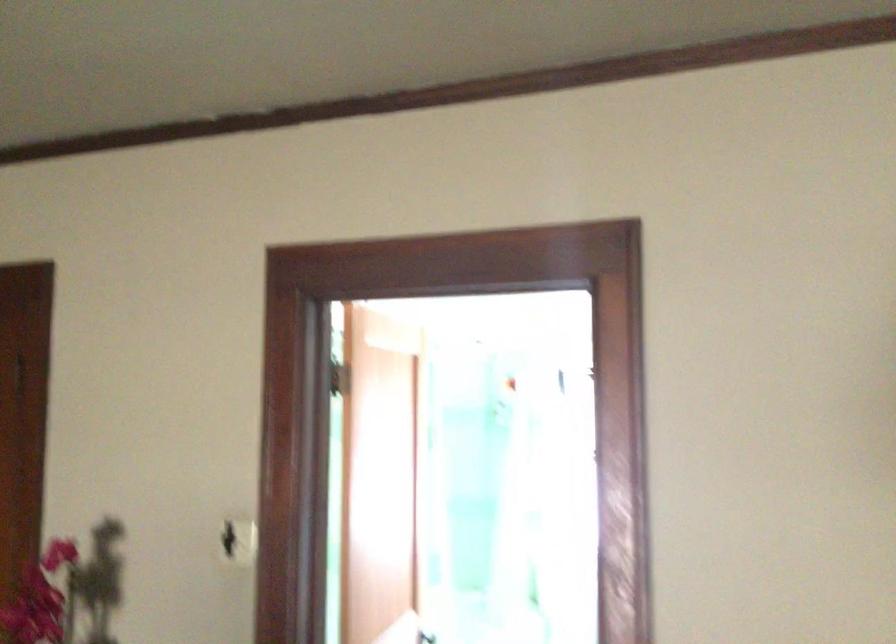
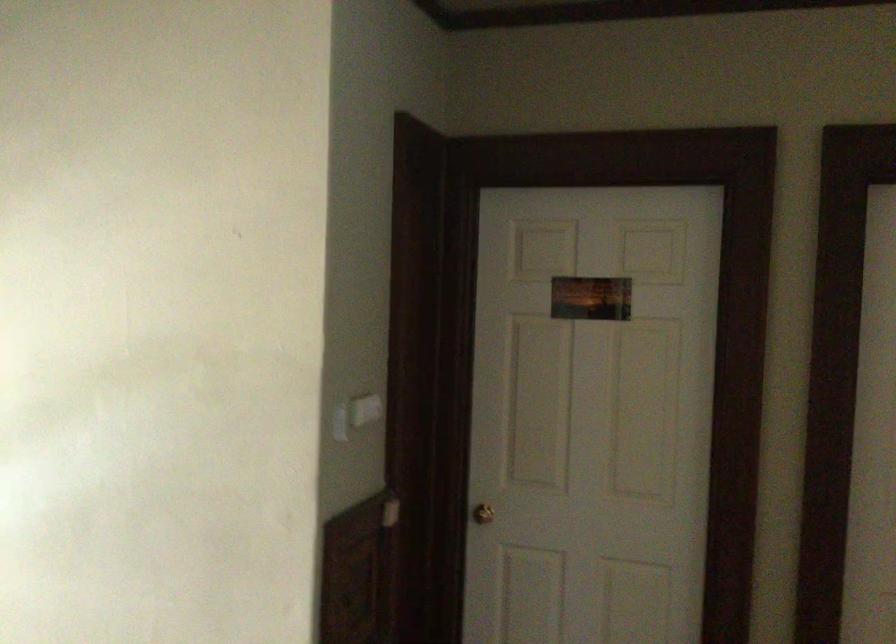
Question: The images are taken continuously from a first-person perspective. In which direction is your viewpoint rotating?

Choices:
 (A) Left
 (B) Right
 (C) Up
 (D) Down

Answer: (A)